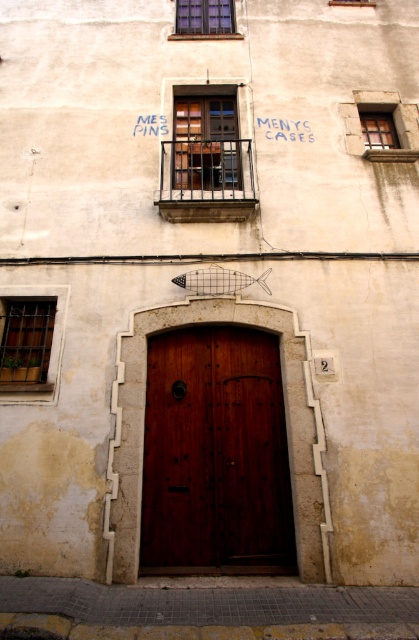
Is polished wood door at center positioned in front of blue painted sign at upper center?

Yes, polished wood door at center is closer to the viewer.

Does polished wood door at center have a lesser width compared to blue painted sign at upper center?

In fact, polished wood door at center might be wider than blue painted sign at upper center.

The image size is (419, 640). Describe the element at coordinates (214, 456) in the screenshot. I see `polished wood door at center` at that location.

This screenshot has height=640, width=419. I want to click on polished wood door at center, so click(x=214, y=456).

Is polished wood door at center bigger than blue painted text at upper center?

Yes.

Between polished wood door at center and blue painted text at upper center, which one has more height?

Standing taller between the two is polished wood door at center.

Locate an element on the screen. polished wood door at center is located at coordinates (214, 456).

Where is `polished wood door at center`? polished wood door at center is located at coordinates (214, 456).

Who is more forward, (372,128) or (348,4)?

Point (372,128) is more forward.

Does wooden at upper right have a lesser height compared to clear glass window at upper center?

Incorrect, wooden at upper right's height does not fall short of clear glass window at upper center's.

Describe the element at coordinates (379, 129) in the screenshot. The width and height of the screenshot is (419, 640). I see `wooden at upper right` at that location.

The height and width of the screenshot is (640, 419). Identify the location of wooden at upper right. (379, 129).